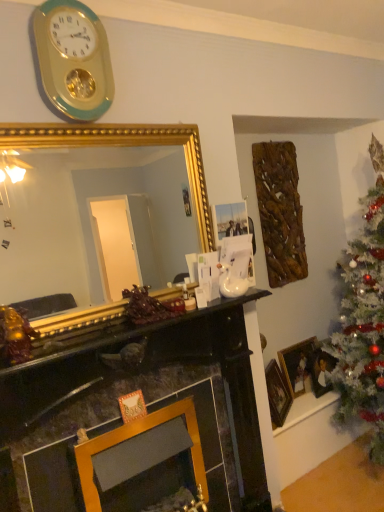
Question: Should I look upward or downward to see gold/green plastic wall clock at upper left?

Choices:
 (A) up
 (B) down

Answer: (A)

Question: From a real-world perspective, is gold-framed picture at right, the first picture frame from the front, physically below gold/gilded mirror at center?

Choices:
 (A) no
 (B) yes

Answer: (B)

Question: Does gold-framed picture at right, the first picture frame from the front, have a larger size compared to gold/gilded mirror at center?

Choices:
 (A) yes
 (B) no

Answer: (B)

Question: From the image's perspective, is gold-framed picture at right, which appears as the 3th picture frame when viewed from the back, located beneath gold/gilded mirror at center?

Choices:
 (A) yes
 (B) no

Answer: (A)

Question: Is gold-framed picture at right, which appears as the 3th picture frame when viewed from the back, wider than gold/gilded mirror at center?

Choices:
 (A) no
 (B) yes

Answer: (B)

Question: Are gold-framed picture at right, the first picture frame from the front, and gold/gilded mirror at center making contact?

Choices:
 (A) yes
 (B) no

Answer: (B)

Question: Is gold-framed picture at right, the first picture frame from the front, facing away from gold/gilded mirror at center?

Choices:
 (A) no
 (B) yes

Answer: (A)

Question: Is white matte christmas tree at right closer to camera compared to gold-framed picture at right, which appears as the 3th picture frame when viewed from the back?

Choices:
 (A) yes
 (B) no

Answer: (A)

Question: Considering the relative positions of white matte christmas tree at right and gold-framed picture at right, the first picture frame from the front, in the image provided, is white matte christmas tree at right to the right of gold-framed picture at right, the first picture frame from the front, from the viewer's perspective?

Choices:
 (A) yes
 (B) no

Answer: (A)

Question: Is white matte christmas tree at right positioned with its back to gold-framed picture at right, the first picture frame from the front?

Choices:
 (A) yes
 (B) no

Answer: (B)

Question: Would you consider white matte christmas tree at right to be distant from gold-framed picture at right, which appears as the 3th picture frame when viewed from the back?

Choices:
 (A) no
 (B) yes

Answer: (A)

Question: Can you confirm if white matte christmas tree at right is shorter than gold-framed picture at right, which appears as the 3th picture frame when viewed from the back?

Choices:
 (A) no
 (B) yes

Answer: (A)

Question: Can you confirm if white matte christmas tree at right is wider than gold-framed picture at right, the first picture frame from the front?

Choices:
 (A) no
 (B) yes

Answer: (B)

Question: Does gold/green plastic wall clock at upper left have a greater height compared to wooden picture frame at right, marked as the third picture frame in a front-to-back arrangement?

Choices:
 (A) yes
 (B) no

Answer: (A)